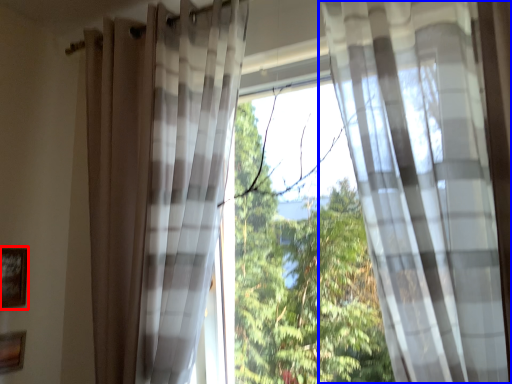
Question: Which of the following is the closest to the observer, picture frame (highlighted by a red box) or curtain (highlighted by a blue box)?

Choices:
 (A) picture frame
 (B) curtain

Answer: (B)